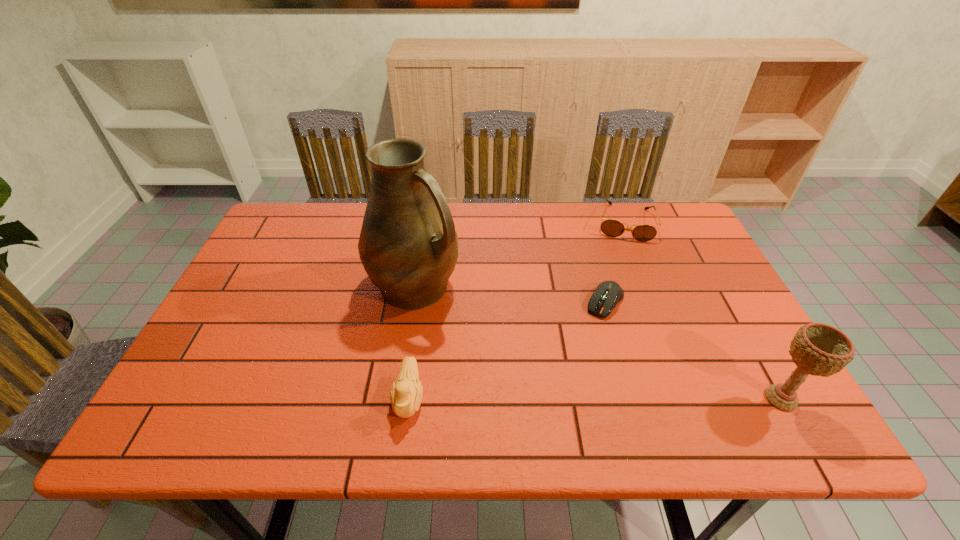
Identify the location of vacant space positioned 0.230m on the handle side of the pitcher. The height and width of the screenshot is (540, 960). (516, 357).

This screenshot has height=540, width=960. I want to click on vacant position located 0.270m on the button of the computer equipment, so click(550, 396).

Where is `vacant space located on the button of the computer equipment`? This screenshot has height=540, width=960. vacant space located on the button of the computer equipment is located at coordinates (552, 393).

Find the location of a particular element. The width and height of the screenshot is (960, 540). vacant space situated on the button of the computer equipment is located at coordinates click(579, 349).

Find the location of a particular element. vacant space located 0.070m on the front-facing side of the farthest object is located at coordinates (623, 256).

The width and height of the screenshot is (960, 540). Find the location of `vacant space located on the front-facing side of the farthest object`. vacant space located on the front-facing side of the farthest object is located at coordinates (622, 279).

At what (x,y) coordinates should I click in order to perform the action: click on vacant space located on the front-facing side of the farthest object. Please return your answer as a coordinate pair (x, y). The width and height of the screenshot is (960, 540). Looking at the image, I should click on (621, 297).

Where is `object present at the far edge`? The height and width of the screenshot is (540, 960). object present at the far edge is located at coordinates (612, 228).

This screenshot has height=540, width=960. Identify the location of duckling that is at the near edge. coord(405,395).

At what (x,y) coordinates should I click in order to perform the action: click on chalice positioned at the near edge. Please return your answer as a coordinate pair (x, y). This screenshot has width=960, height=540. Looking at the image, I should click on (819, 349).